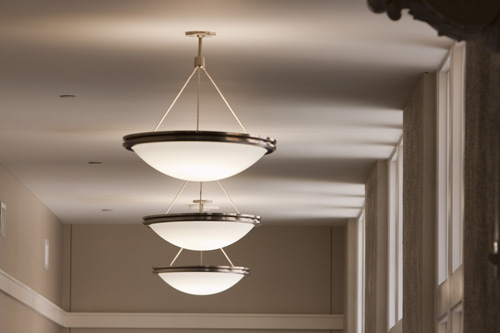
Where is `lights hanging on ceiling`? This screenshot has width=500, height=333. lights hanging on ceiling is located at coordinates (207, 157), (201, 233), (204, 284).